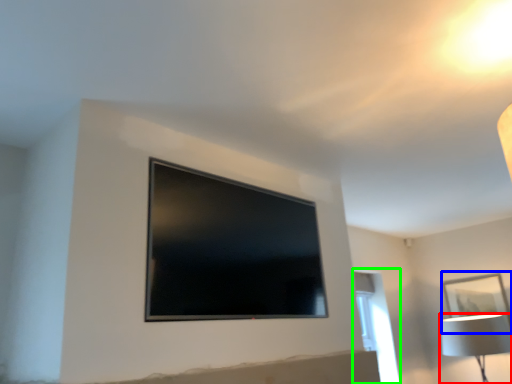
Question: Estimate the real-world distances between objects in this image. Which object is farther from lamp (highlighted by a red box), picture frame (highlighted by a blue box) or window (highlighted by a green box)?

Choices:
 (A) picture frame
 (B) window

Answer: (B)